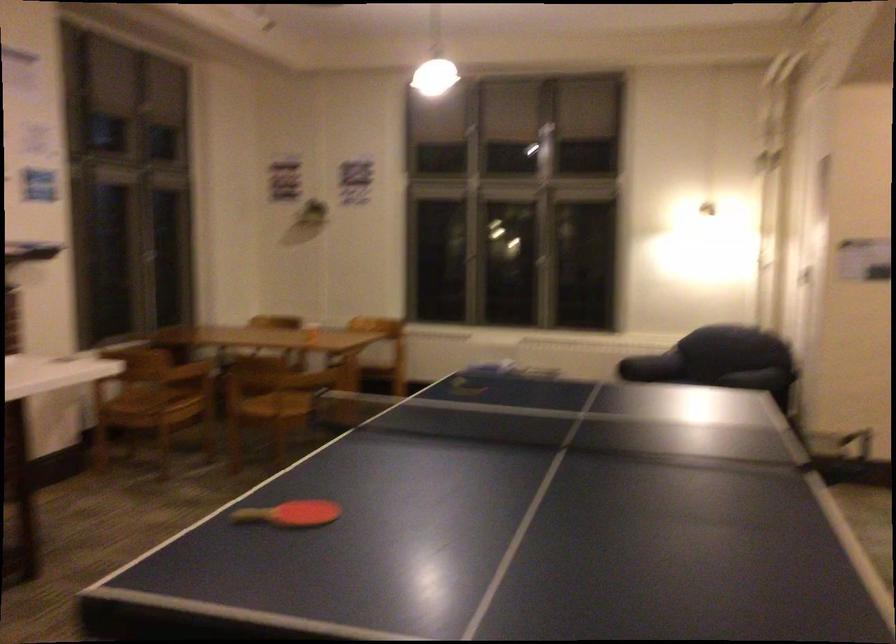
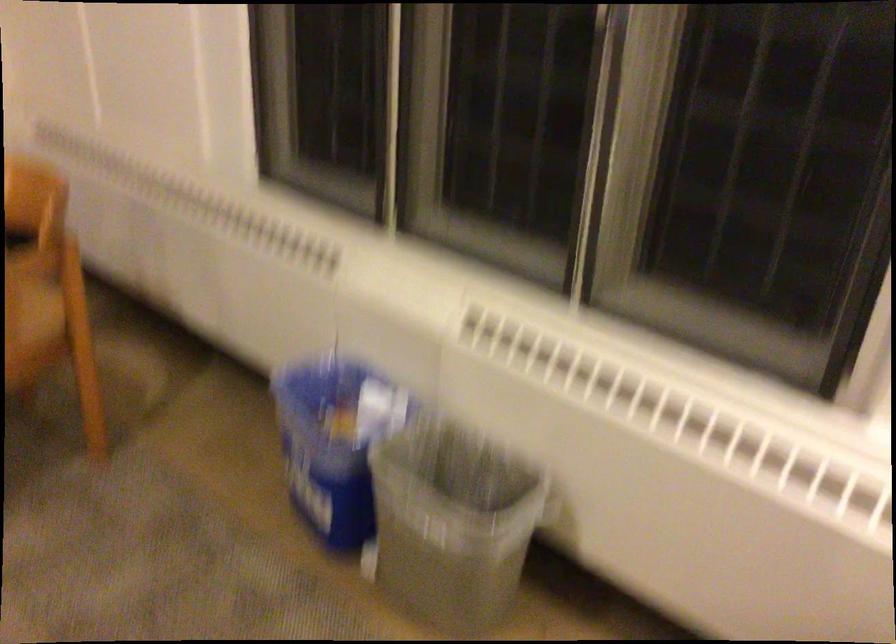
The point at (x=561, y=368) is marked in the first image. Where is the corresponding point in the second image?

(451, 524)